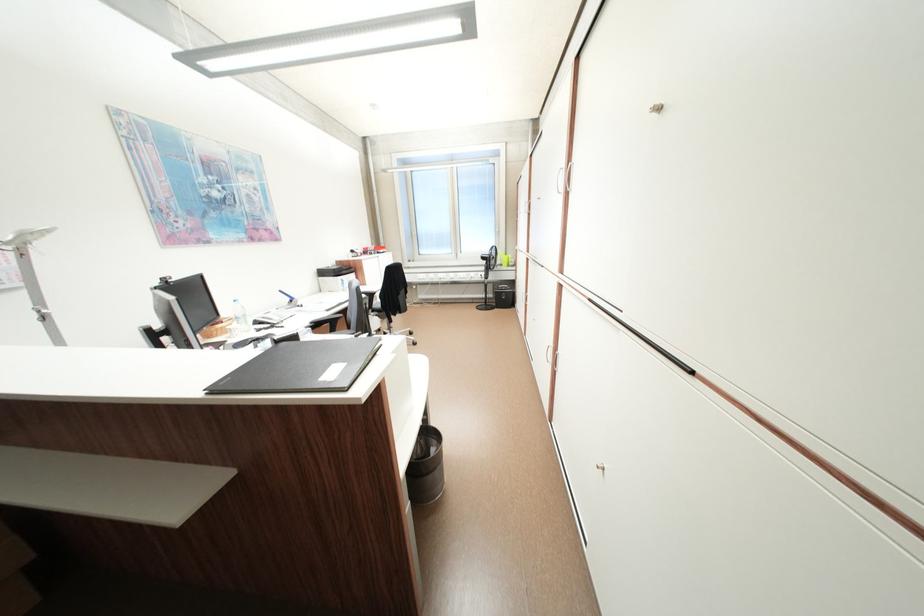
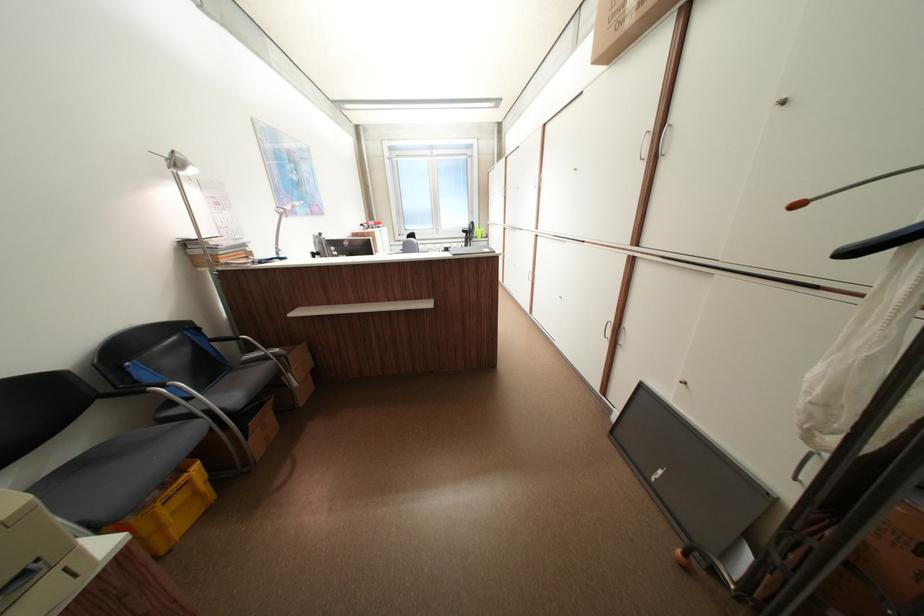
Which direction would the cameraman need to move to produce the second image?

→ The cameraman walked toward left, backward.